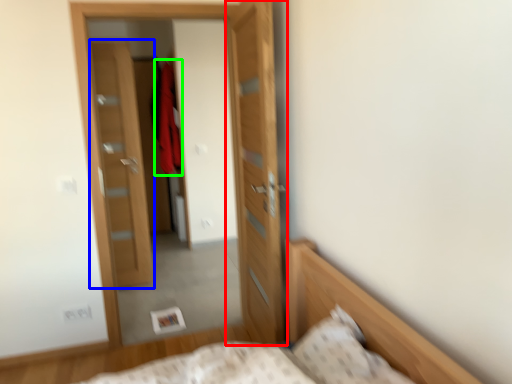
Question: Considering the real-world distances, which object is farthest from door (highlighted by a red box)? door (highlighted by a blue box) or robe (highlighted by a green box)?

Choices:
 (A) door
 (B) robe

Answer: (B)